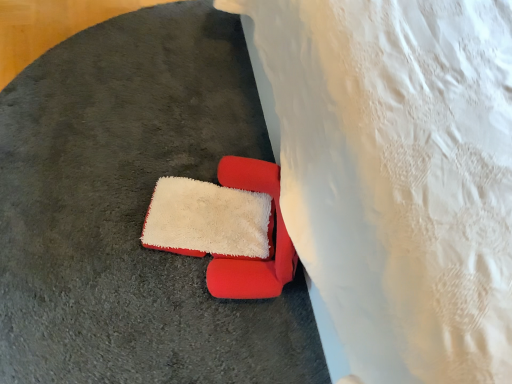
What do you see at coordinates (268, 236) in the screenshot?
I see `velvet red chair at center` at bounding box center [268, 236].

Locate an element on the screen. Image resolution: width=512 pixels, height=384 pixels. velvet red chair at center is located at coordinates 268,236.

Identify the location of white lace bedsheet at lower right. The image size is (512, 384). (399, 176).

Describe the element at coordinates (399, 176) in the screenshot. This screenshot has height=384, width=512. I see `white lace bedsheet at lower right` at that location.

This screenshot has height=384, width=512. I want to click on velvet red chair at center, so click(268, 236).

Can you confirm if velvet red chair at center is positioned to the left of white lace bedsheet at lower right?

Yes.

Is velvet red chair at center in front of white lace bedsheet at lower right?

That is False.

Does point (227, 184) come in front of point (315, 182)?

No, it is behind (315, 182).

From the image's perspective, is velvet red chair at center located beneath white lace bedsheet at lower right?

Yes, from the image's perspective, velvet red chair at center is beneath white lace bedsheet at lower right.

From a real-world perspective, is velvet red chair at center below white lace bedsheet at lower right?

Yes, from a real-world perspective, velvet red chair at center is below white lace bedsheet at lower right.

Which of these two, velvet red chair at center or white lace bedsheet at lower right, is wider?

white lace bedsheet at lower right.

From their relative heights in the image, would you say velvet red chair at center is taller or shorter than white lace bedsheet at lower right?

velvet red chair at center is shorter than white lace bedsheet at lower right.

Based on the photo, looking at the image, does velvet red chair at center seem bigger or smaller compared to white lace bedsheet at lower right?

Considering their sizes, velvet red chair at center takes up less space than white lace bedsheet at lower right.

Would you say velvet red chair at center is outside white lace bedsheet at lower right?

That's correct, velvet red chair at center is outside of white lace bedsheet at lower right.

Is velvet red chair at center positioned far away from white lace bedsheet at lower right?

No, velvet red chair at center is not far from white lace bedsheet at lower right.

Is velvet red chair at center looking in the opposite direction of white lace bedsheet at lower right?

Yes.

The height and width of the screenshot is (384, 512). I want to click on chair located underneath the white lace bedsheet at lower right (from a real-world perspective), so click(268, 236).

Is white lace bedsheet at lower right at the right side of velvet red chair at center?

Yes, white lace bedsheet at lower right is to the right of velvet red chair at center.

Considering the positions of objects white lace bedsheet at lower right and velvet red chair at center in the image provided, who is in front, white lace bedsheet at lower right or velvet red chair at center?

Positioned in front is white lace bedsheet at lower right.

Considering the positions of point (381, 208) and point (241, 182), is point (381, 208) closer or farther from the camera than point (241, 182)?

Point (381, 208) is closer to the camera than point (241, 182).

From the image's perspective, is white lace bedsheet at lower right beneath velvet red chair at center?

No, from the image's perspective, white lace bedsheet at lower right is not below velvet red chair at center.

From a real-world perspective, is white lace bedsheet at lower right above or below velvet red chair at center?

white lace bedsheet at lower right is above velvet red chair at center.

In terms of width, does white lace bedsheet at lower right look wider or thinner when compared to velvet red chair at center?

white lace bedsheet at lower right is wider than velvet red chair at center.

Does white lace bedsheet at lower right have a lesser height compared to velvet red chair at center?

No.

Between white lace bedsheet at lower right and velvet red chair at center, which one has smaller size?

With smaller size is velvet red chair at center.

Would you say white lace bedsheet at lower right is outside velvet red chair at center?

white lace bedsheet at lower right is positioned outside velvet red chair at center.

Would you say white lace bedsheet at lower right is a long distance from velvet red chair at center?

→ That's not correct — white lace bedsheet at lower right is a little close to velvet red chair at center.

Could you tell me if white lace bedsheet at lower right is facing velvet red chair at center?

Yes, white lace bedsheet at lower right is facing velvet red chair at center.

What's the angular difference between white lace bedsheet at lower right and velvet red chair at center's facing directions?

white lace bedsheet at lower right and velvet red chair at center are facing 20.3 degrees away from each other.

How much distance is there between white lace bedsheet at lower right and velvet red chair at center?

white lace bedsheet at lower right is 13.02 inches from velvet red chair at center.

Where is `sheet positioned vertically above the velvet red chair at center (from a real-world perspective)`? This screenshot has height=384, width=512. sheet positioned vertically above the velvet red chair at center (from a real-world perspective) is located at coordinates (399, 176).

Find the location of a particular element. The width and height of the screenshot is (512, 384). chair below the white lace bedsheet at lower right (from the image's perspective) is located at coordinates (268, 236).

In order to click on chair that appears on the left of white lace bedsheet at lower right in this screenshot , I will do `click(268, 236)`.